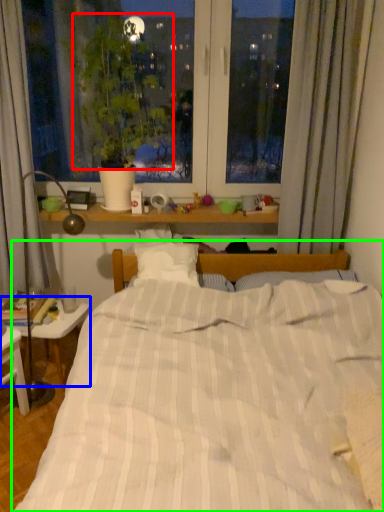
Question: Based on their relative distances, which object is farther from plant (highlighted by a red box)? Choose from table (highlighted by a blue box) and bed (highlighted by a green box).

Choices:
 (A) table
 (B) bed

Answer: (A)